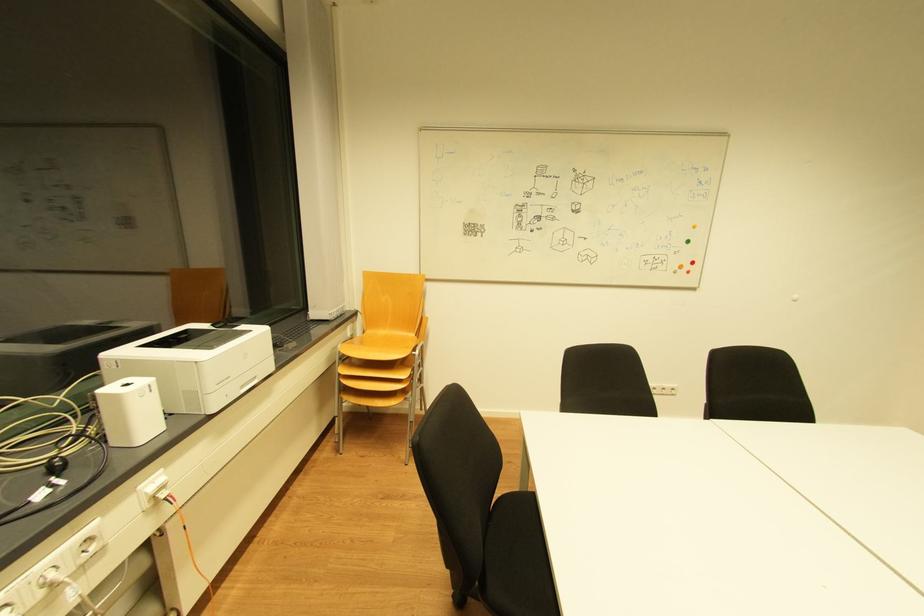
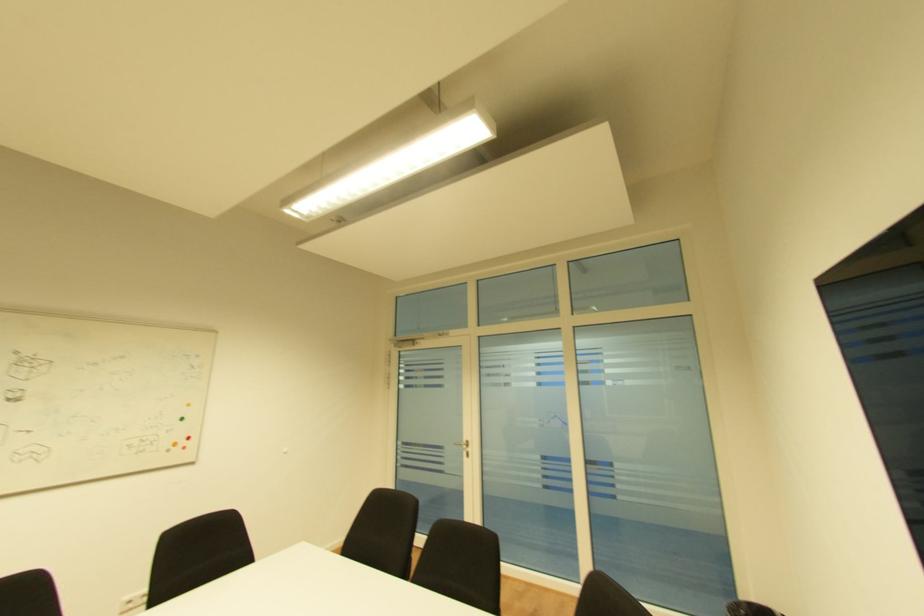
How did the camera likely rotate?

The camera's rotation is toward right-up.